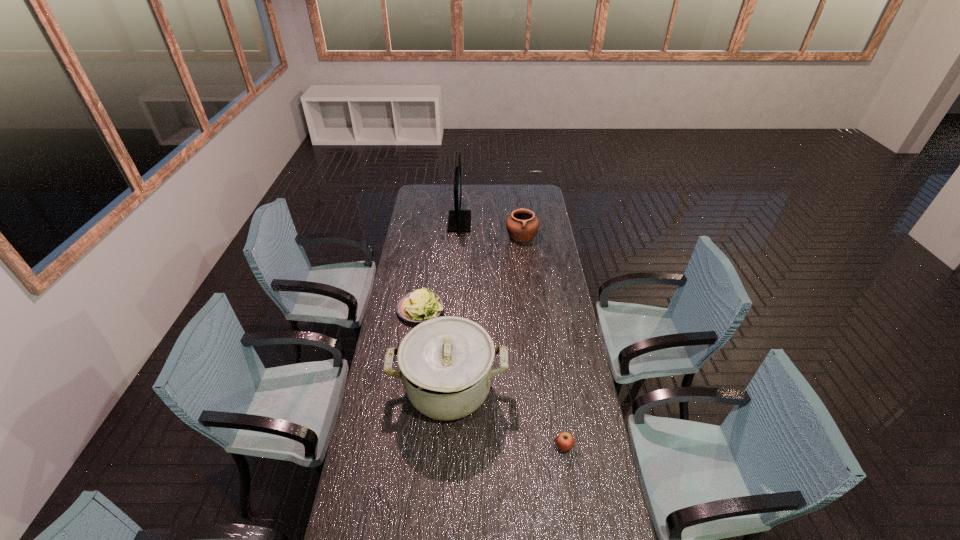
What are the coordinates of `vacant space that satisfies the following two spatial constraints: 1. on the screen side of the apple; 2. on the left side of the tallest object` in the screenshot? It's located at 445,447.

This screenshot has height=540, width=960. What are the coordinates of `free location that satisfies the following two spatial constraints: 1. on the front side of the third nearest object; 2. on the left side of the apple` in the screenshot? It's located at (401, 447).

Where is `free spot that satisfies the following two spatial constraints: 1. on the screen side of the tallest object; 2. on the back side of the pottery`? This screenshot has width=960, height=540. free spot that satisfies the following two spatial constraints: 1. on the screen side of the tallest object; 2. on the back side of the pottery is located at coordinates (459, 235).

Where is `free space that satisfies the following two spatial constraints: 1. on the screen side of the nearest object; 2. on the right side of the monitor`? free space that satisfies the following two spatial constraints: 1. on the screen side of the nearest object; 2. on the right side of the monitor is located at coordinates (445, 447).